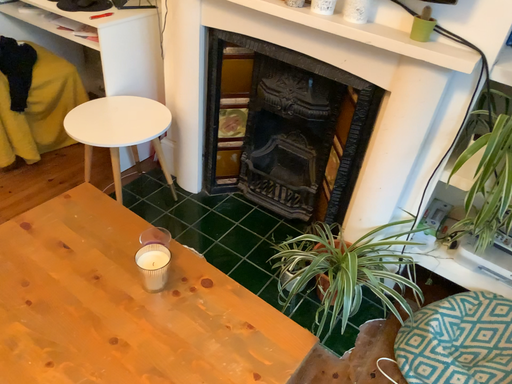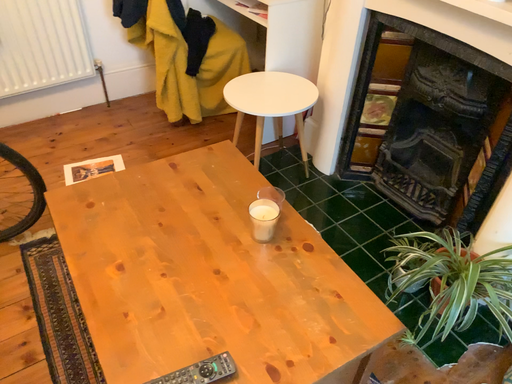
Question: How did the camera likely rotate when shooting the video?

Choices:
 (A) rotated right
 (B) rotated left

Answer: (B)